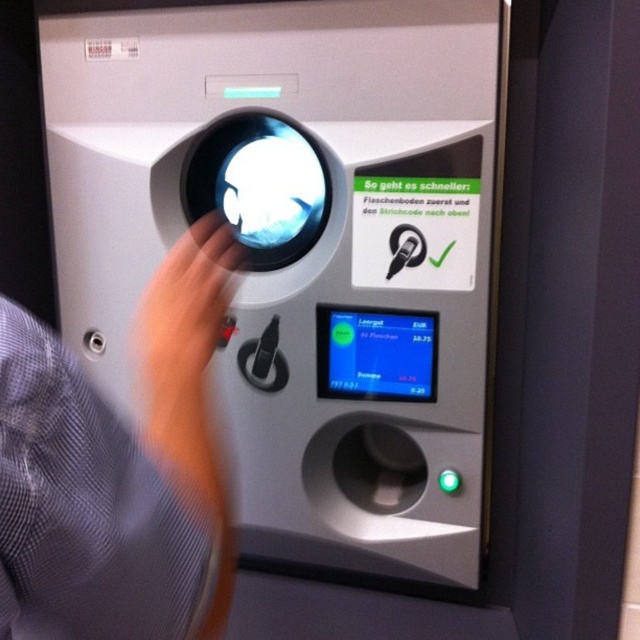
Question: Among these points, which one is farthest from the camera?

Choices:
 (A) coord(17,451)
 (B) coord(326,81)
 (C) coord(186,364)

Answer: (B)

Question: Is metallic gray button at center smaller than matte black hand at upper center?

Choices:
 (A) no
 (B) yes

Answer: (A)

Question: Considering the real-world distances, which object is closest to the metallic gray button at center?

Choices:
 (A) skinny fabric hand at center
 (B) matte black hand at upper center

Answer: (B)

Question: Among these points, which one is nearest to the camera?

Choices:
 (A) (54, 464)
 (B) (116, 316)

Answer: (A)

Question: Does metallic gray button at center have a lesser width compared to matte black hand at upper center?

Choices:
 (A) no
 (B) yes

Answer: (A)

Question: Can you confirm if metallic gray button at center is positioned above skinny fabric hand at center?

Choices:
 (A) no
 (B) yes

Answer: (B)